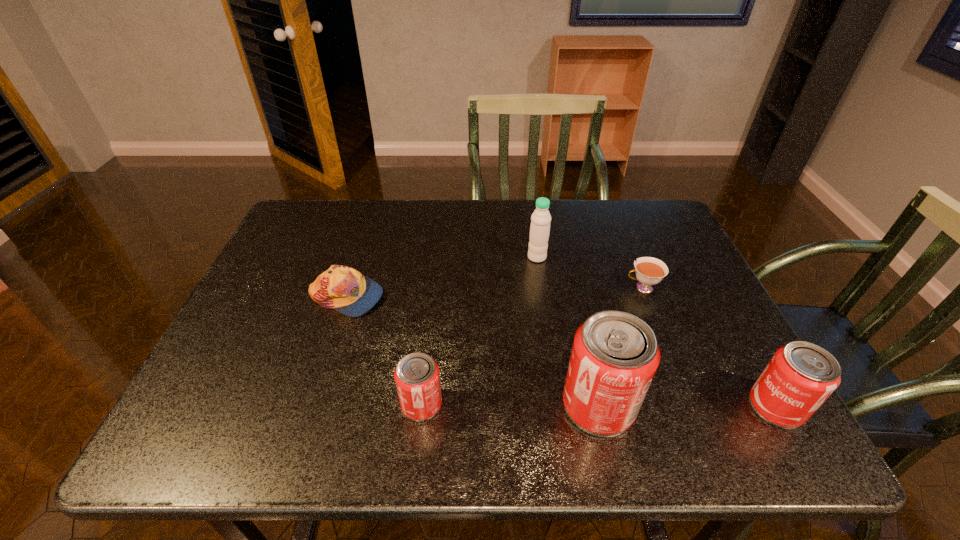
The image size is (960, 540). Find the location of `the leftmost can`. the leftmost can is located at coordinates (417, 378).

Identify the location of the shortest can. (417, 378).

The width and height of the screenshot is (960, 540). Find the location of `the tallest can`. the tallest can is located at coordinates (615, 355).

Identify the location of the rightmost can. The width and height of the screenshot is (960, 540). (800, 376).

Locate an element on the screen. This screenshot has height=540, width=960. the fourth shortest object is located at coordinates (800, 376).

The height and width of the screenshot is (540, 960). I want to click on water bottle, so click(x=540, y=220).

Locate an element on the screen. This screenshot has height=540, width=960. the fifth object from left to right is located at coordinates (649, 271).

The height and width of the screenshot is (540, 960). Identify the location of the leftmost object. (344, 289).

This screenshot has height=540, width=960. In order to click on free space located on the right of the leftmost can in this screenshot , I will do 501,404.

At what (x,y) coordinates should I click in order to perform the action: click on free space located 0.370m on the left of the tallest can. Please return your answer as a coordinate pair (x, y). Looking at the image, I should click on (378, 406).